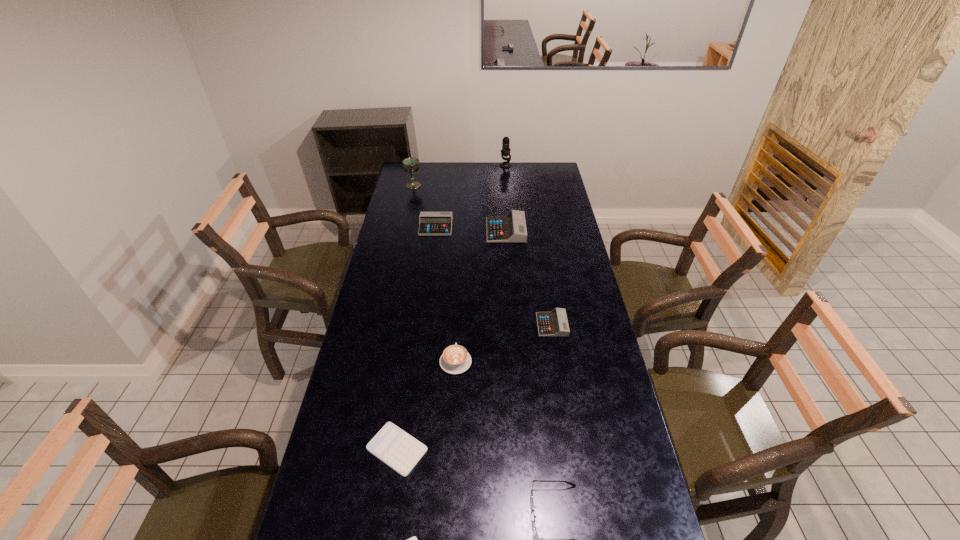
The image size is (960, 540). In order to click on free space between the second calculator from right to left and the tallest object in this screenshot , I will do pyautogui.click(x=506, y=198).

At what (x,y) coordinates should I click in order to perform the action: click on unoccupied position between the seventh tallest object and the second farthest object. Please return your answer as a coordinate pair (x, y). This screenshot has width=960, height=540. Looking at the image, I should click on (483, 255).

Where is `free space between the second biggest gray calculator and the smallest gray calculator`? Image resolution: width=960 pixels, height=540 pixels. free space between the second biggest gray calculator and the smallest gray calculator is located at coordinates (493, 275).

Locate an element on the screen. This screenshot has height=540, width=960. free space between the tallest object and the second gray calculator from right to left is located at coordinates (506, 198).

This screenshot has height=540, width=960. What are the coordinates of `free area in between the cappuccino and the chalice` in the screenshot? It's located at click(x=435, y=273).

The image size is (960, 540). Find the location of `free spot between the farthest object and the cappuccino`. free spot between the farthest object and the cappuccino is located at coordinates (480, 264).

This screenshot has height=540, width=960. In order to click on object that is the fourth closest to the tallest object in this screenshot , I will do `click(550, 324)`.

Identify the location of object that stands as the third closest to the black spectacles. The image size is (960, 540). (455, 359).

Where is `the second closest calculator to the second biggest gray calculator`? This screenshot has height=540, width=960. the second closest calculator to the second biggest gray calculator is located at coordinates (550, 324).

Identify which calculator is the second closest to the microphone. Please provide its 2D coordinates. Your answer should be formatted as a tuple, i.e. [(x, y)], where the tuple contains the x and y coordinates of a point satisfying the conditions above.

[(431, 223)]